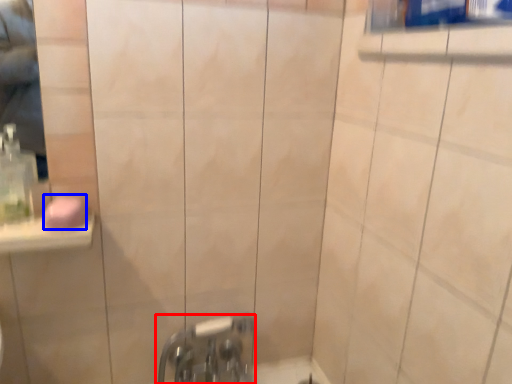
Question: Which object is closer to the camera taking this photo, tap (highlighted by a red box) or soap (highlighted by a blue box)?

Choices:
 (A) tap
 (B) soap

Answer: (B)